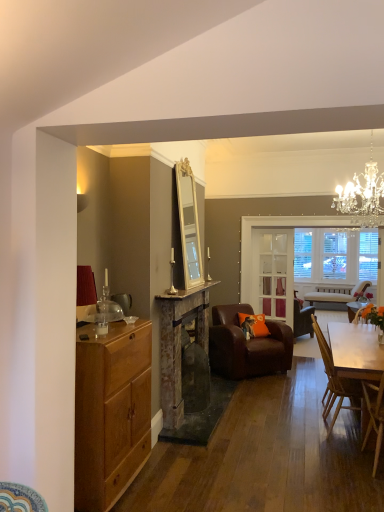
Question: From the image's perspective, is rustic stone fireplace at center positioned above or below wooden chair at right, placed as the 2th chair when sorted from back to front?

Choices:
 (A) below
 (B) above

Answer: (B)

Question: Is rustic stone fireplace at center in front of or behind wooden chair at right, placed as the 2th chair when sorted from back to front, in the image?

Choices:
 (A) behind
 (B) front

Answer: (A)

Question: Estimate the real-world distances between objects in this image. Which object is closer to the rustic stone fireplace at center?

Choices:
 (A) orange fabric pillow at center
 (B) clear glass door at center
 (C) brown leather armchair at center, which is counted as the first chair, starting from the back
 (D) wooden chair at lower right, the first chair in the front-to-back sequence
 (E) light brown wood cabinet at left

Answer: (C)

Question: Considering the real-world distances, which object is farthest from the rustic stone fireplace at center?

Choices:
 (A) light brown wood cabinet at left
 (B) brown leather armchair at center, the 3th chair viewed from the front
 (C) wooden chair at lower right, which is the 3th chair from back to front
 (D) crystal chandelier at upper right
 (E) orange fabric pillow at center

Answer: (D)